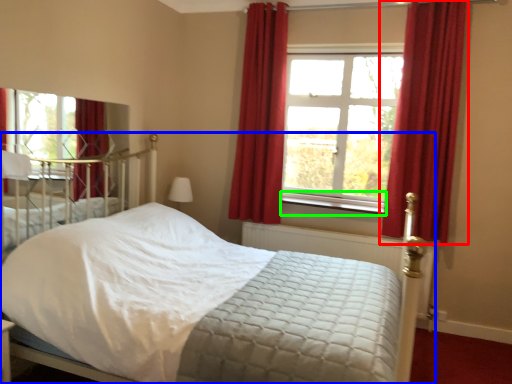
Question: Which object is positioned closest to curtain (highlighted by a red box)? Select from bed (highlighted by a blue box) and window sill (highlighted by a green box).

Choices:
 (A) bed
 (B) window sill

Answer: (A)